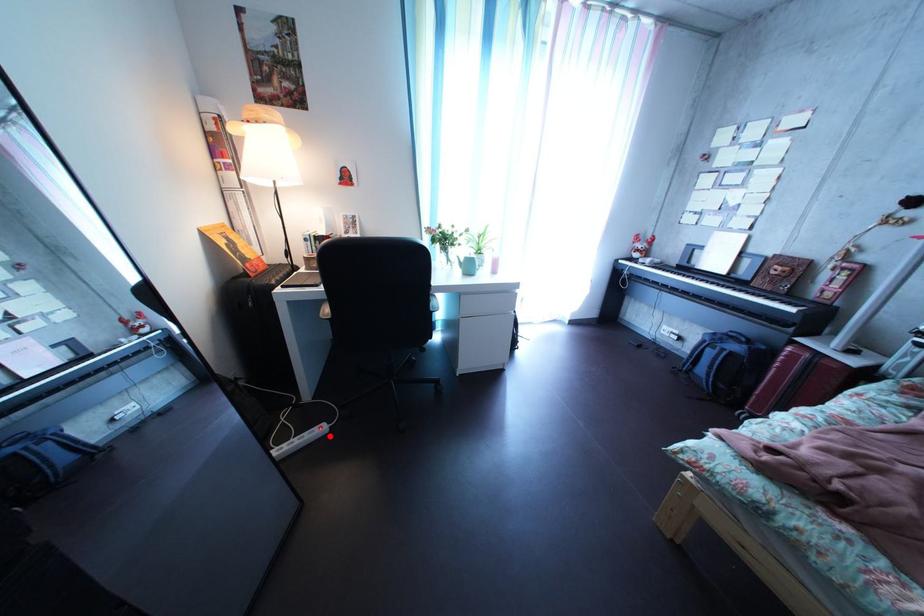
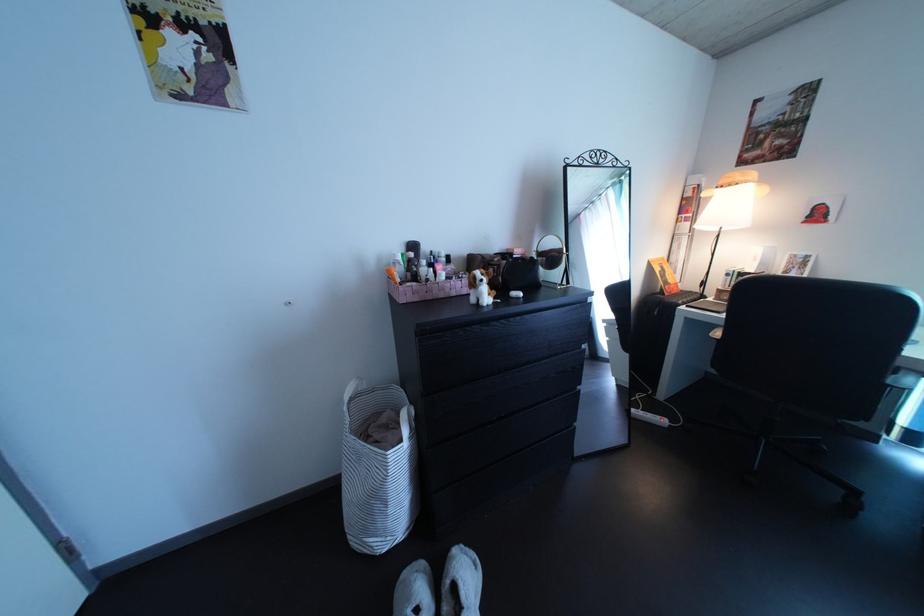
Where in the second image is the point corresponding to the highlighted location from the first image?

(673, 424)